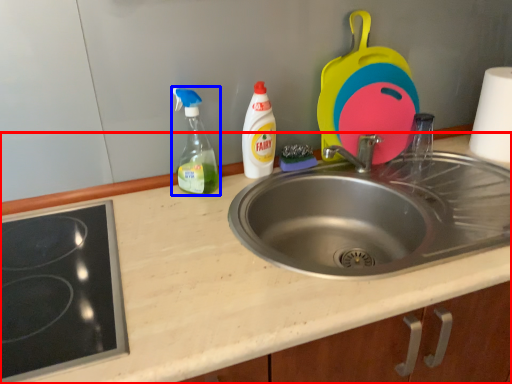
Question: Which object is closer to the camera taking this photo, counter top (highlighted by a red box) or bottle (highlighted by a blue box)?

Choices:
 (A) counter top
 (B) bottle

Answer: (A)